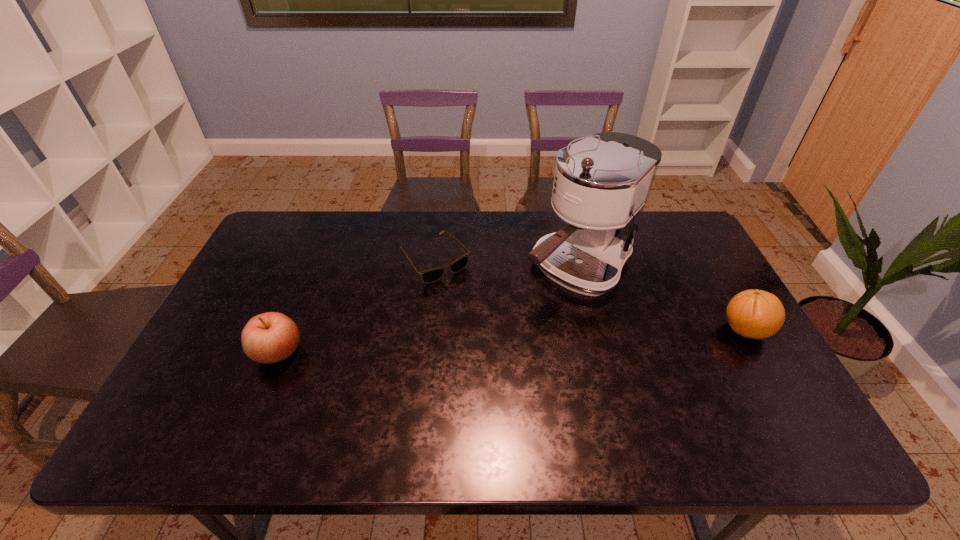
I want to click on vacant space on the desktop that is between the apple and the rightmost object and is positioned on the front-facing side of the coffee maker, so click(492, 342).

I want to click on free space on the desktop that is between the apple and the rightmost object and is positioned on the lenses of the third object from right to left, so click(x=504, y=342).